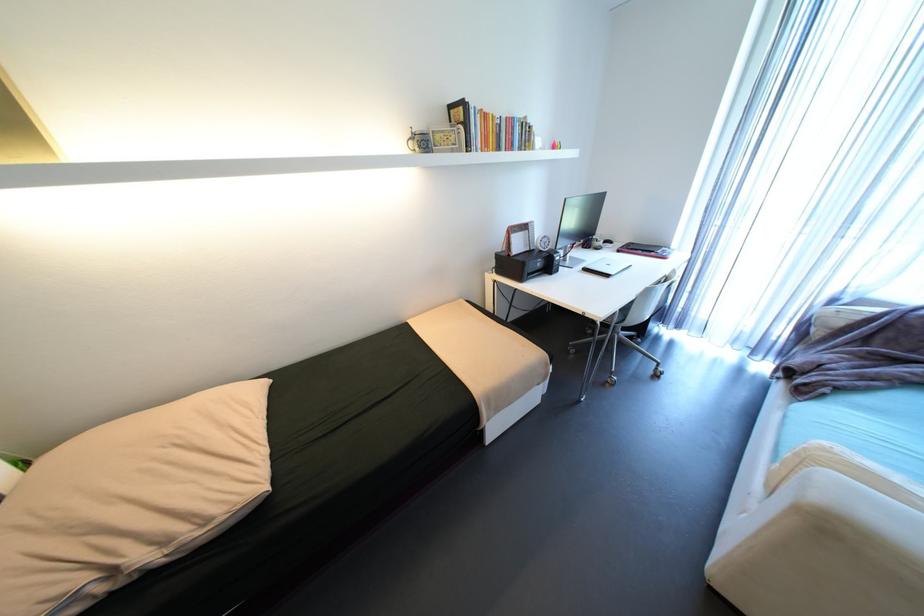
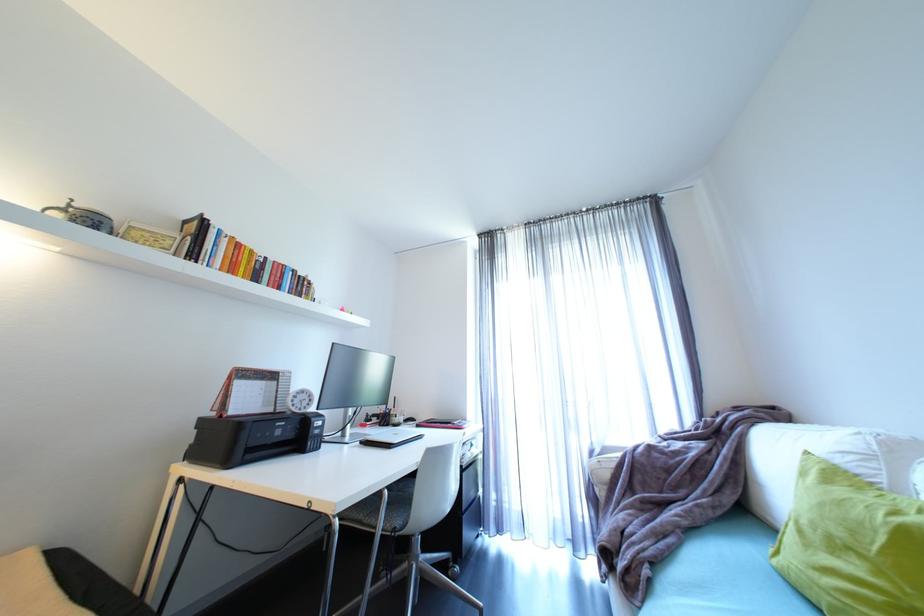
In the second image, find the point that corresponds to pixel 480 148 in the first image.

(208, 262)